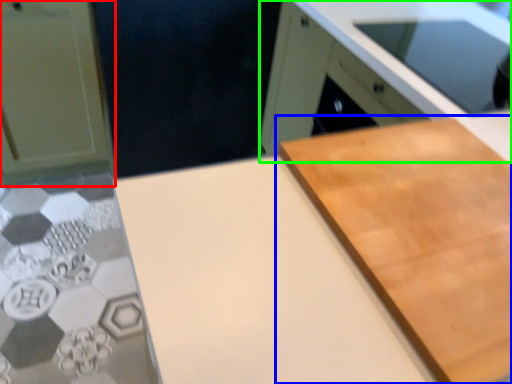
Question: Which object is the closest to the cabinetry (highlighted by a red box)? Choose among these: cutting board (highlighted by a blue box) or cabinetry (highlighted by a green box).

Choices:
 (A) cutting board
 (B) cabinetry

Answer: (B)